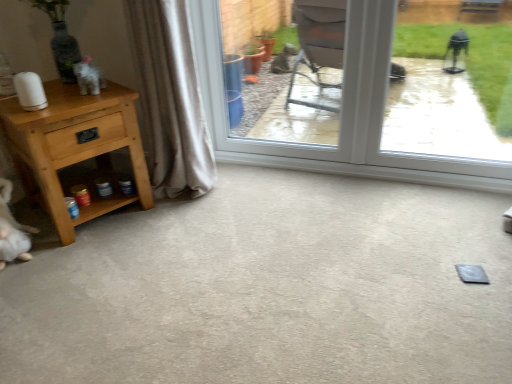
The image size is (512, 384). In order to click on free location in front of beige fabric curtain at left in this screenshot , I will do `click(180, 216)`.